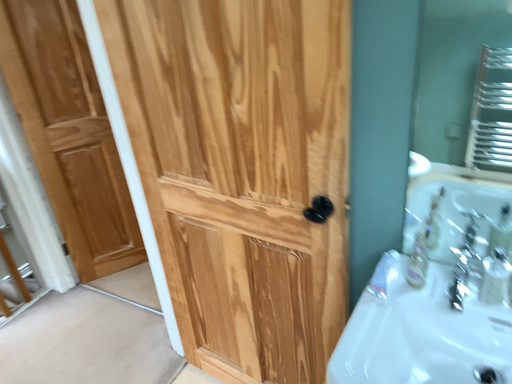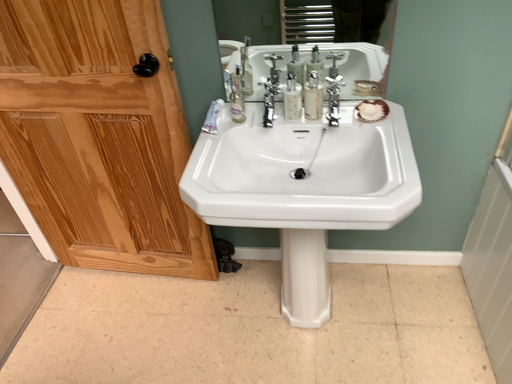
Question: Which way did the camera rotate in the video?

Choices:
 (A) rotated upward
 (B) rotated downward

Answer: (B)